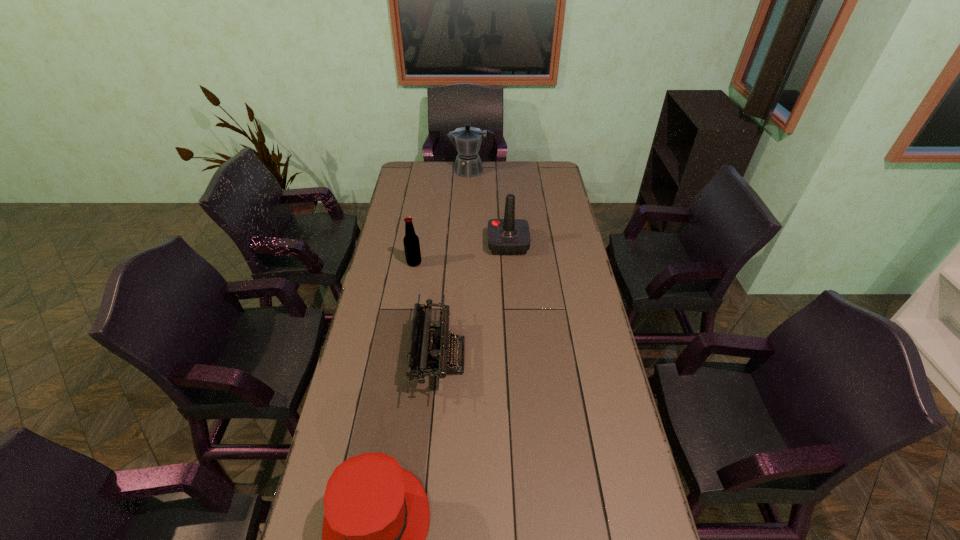
Where is `free space between the second nearest object and the farthest object`? free space between the second nearest object and the farthest object is located at coordinates (455, 264).

At what (x,y) coordinates should I click in order to perform the action: click on free space between the coffeepot and the beer bottle. Please return your answer as a coordinate pair (x, y). This screenshot has height=540, width=960. Looking at the image, I should click on (443, 217).

Choose which object is the fourth nearest neighbor to the joystick. Please provide its 2D coordinates. Your answer should be formatted as a tuple, i.e. [(x, y)], where the tuple contains the x and y coordinates of a point satisfying the conditions above.

[(377, 515)]

Locate an element on the screen. This screenshot has width=960, height=540. object that stands as the third closest to the shortest object is located at coordinates (509, 236).

At what (x,y) coordinates should I click in order to perform the action: click on vacant point that satisfies the following two spatial constraints: 1. at the spout of the coffeepot; 2. on the right side of the second farthest object. Please return your answer as a coordinate pair (x, y). The width and height of the screenshot is (960, 540). Looking at the image, I should click on (468, 244).

Identify the location of free location that satisfies the following two spatial constraints: 1. at the spout of the coffeepot; 2. on the front side of the beer bottle. (468, 263).